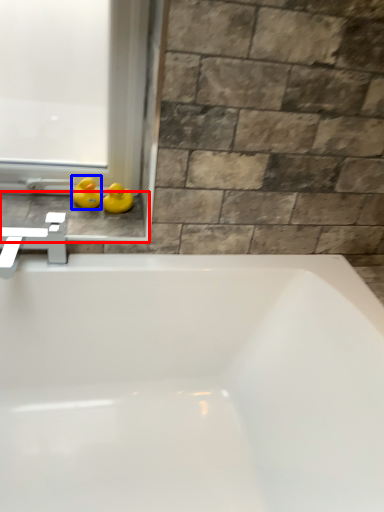
Question: Which object appears farthest to the camera in this image, window sill (highlighted by a red box) or duck (highlighted by a blue box)?

Choices:
 (A) window sill
 (B) duck

Answer: (B)